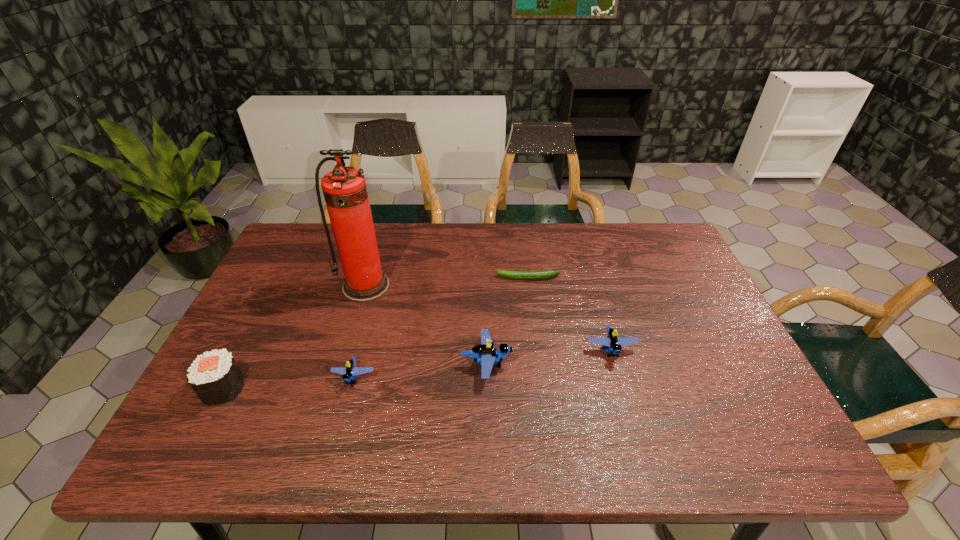
Locate an element on the screen. vacant region between the fire extinguisher and the tallest Lego is located at coordinates (426, 325).

What are the coordinates of `free spot between the shortest Lego and the fire extinguisher` in the screenshot? It's located at (360, 332).

Identify which object is the closest to the second Lego from left to right. Please provide its 2D coordinates. Your answer should be formatted as a tuple, i.e. [(x, y)], where the tuple contains the x and y coordinates of a point satisfying the conditions above.

[(612, 342)]

At what (x,y) coordinates should I click in order to perform the action: click on object that ranks as the third closest to the second Lego from left to right. Please return your answer as a coordinate pair (x, y). Looking at the image, I should click on (528, 275).

This screenshot has width=960, height=540. In order to click on Lego that can be found as the second closest to the fire extinguisher in this screenshot , I will do `click(486, 353)`.

The height and width of the screenshot is (540, 960). Identify the location of Lego object that ranks as the second closest to the second Lego from left to right. (349, 372).

Locate an element on the screen. Image resolution: width=960 pixels, height=540 pixels. vacant point that satisfies the following two spatial constraints: 1. on the front-facing side of the zucchini; 2. at the discharge end of the tallest object is located at coordinates (529, 286).

Locate an element on the screen. vacant point that satisfies the following two spatial constraints: 1. on the front-facing side of the zucchini; 2. on the front-facing side of the shortest Lego is located at coordinates [x=540, y=377].

This screenshot has width=960, height=540. In order to click on vacant space that satisfies the following two spatial constraints: 1. on the front-facing side of the tallest Lego; 2. on the front-facing side of the second shortest object in this screenshot , I will do `click(487, 377)`.

Find the location of a particular element. The height and width of the screenshot is (540, 960). blank area in the image that satisfies the following two spatial constraints: 1. on the front-facing side of the zucchini; 2. on the front-facing side of the shortest Lego is located at coordinates (540, 377).